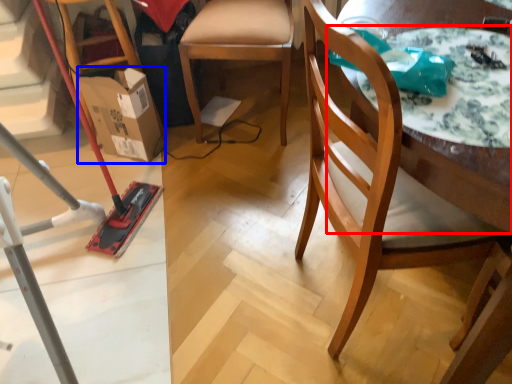
Question: Which object appears closest to the camera in this image, round table (highlighted by a red box) or cardboard box (highlighted by a blue box)?

Choices:
 (A) round table
 (B) cardboard box

Answer: (A)